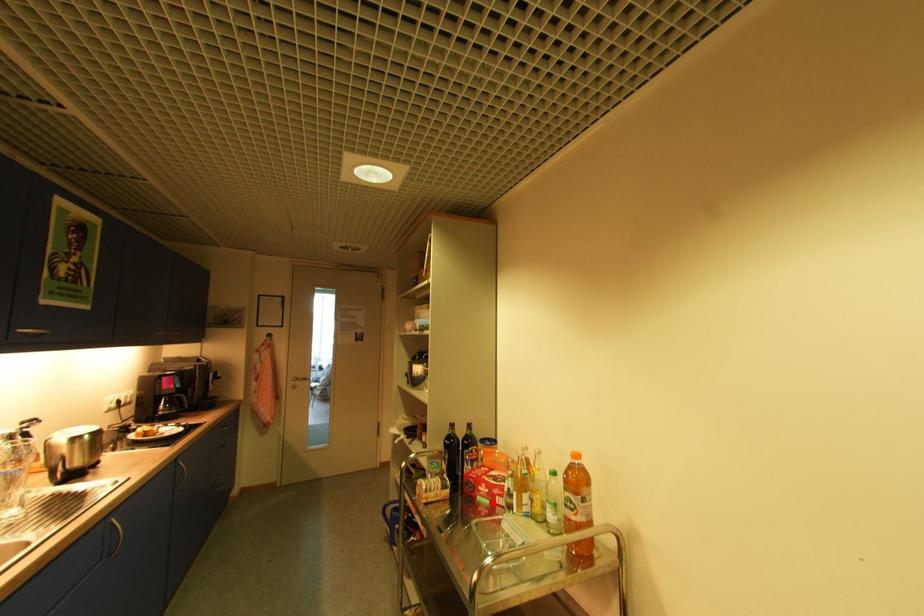
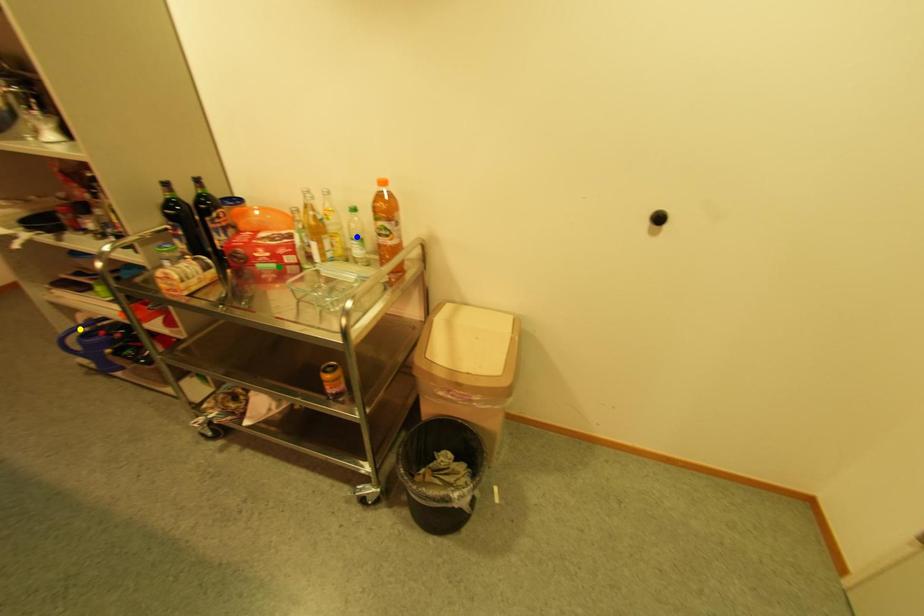
Question: I am providing you with two images of the same scene from different viewpoints. A red point is marked on the first image. You are given multiple points on the second image. Can you choose the point in image 2 that corresponds to the point in image 1?

Choices:
 (A) blue point
 (B) yellow point
 (C) green point

Answer: (C)